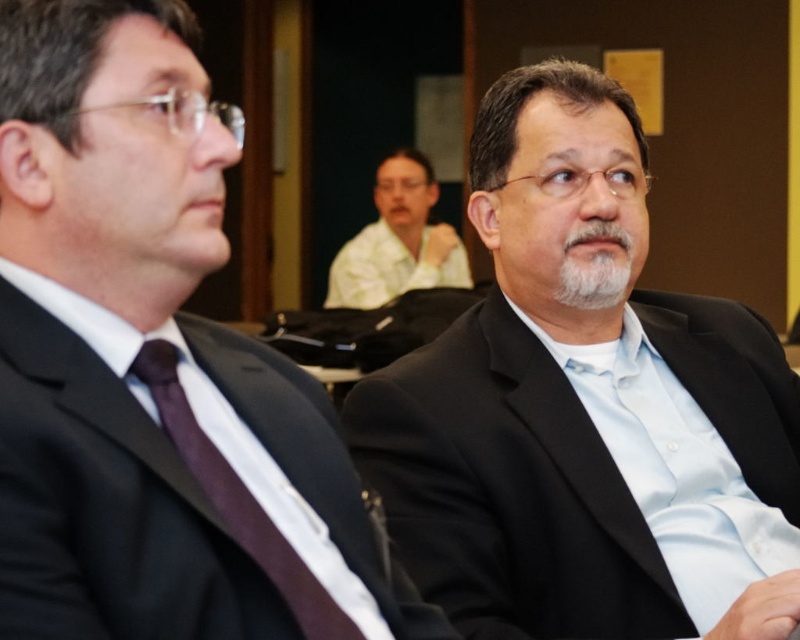
You are a photographer setting up for a group photo. You need to arrange the black matte suit at center and the dark purple silk tie at left so that both are visible in the frame. Given their sizes, which object should be placed closer to the camera to ensure both are fully visible?

The black matte suit at center is taller than the dark purple silk tie at left. To ensure both are fully visible in the frame, the dark purple silk tie at left should be placed closer to the camera since it is shorter, allowing the taller black matte suit at center to be positioned slightly farther back but still within the frame.